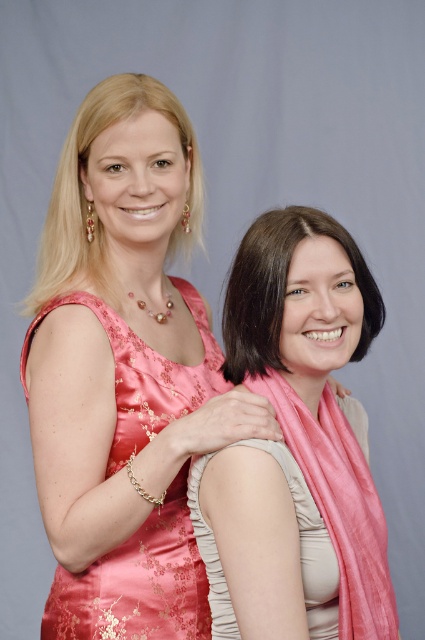
You are a photographer trying to capture a closeup of the smooth brown hair at center without the pink silk scarf at right appearing in the frame. Is it possible to do so given their sizes?

The pink silk scarf at right is bigger than the smooth brown hair at center, so it might block part of the hair. However, since the scarf is at the right and the hair is at the center, adjusting the camera angle slightly to the right could exclude the scarf while focusing on the hair.

You are a photographer trying to capture a clear photo of both the satin dress at left and the smooth brown hair at center. Since you want to focus on the smaller object, which one should you adjust your camera to focus on?

The smooth brown hair at center is smaller than the satin dress at left, so you should adjust your camera to focus on the smooth brown hair at center.

You are a photographer setting up for a photoshoot. You need to ensure that the pink silk scarf at right and the satin dress at left are visible in the frame. Given that the camera has a limited field of view, which object should you prioritize positioning closer to the camera to ensure it takes up more space in the photo?

The pink silk scarf at right should be positioned closer to the camera because it is bigger than the satin dress at left, so moving it closer will help it occupy more space in the frame without overcrowding the image.